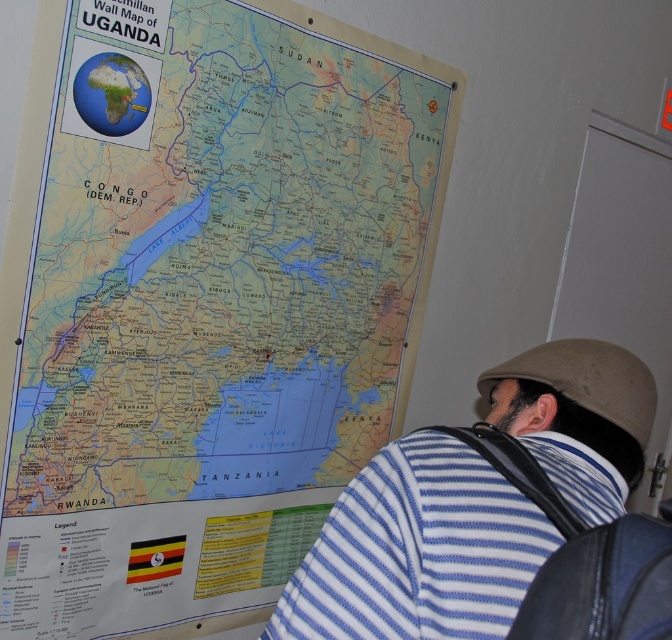
You are a visitor in a room and you see the matte paper map at upper center and the blue striped shirt at center. Which object is closer to you?

The matte paper map at upper center is closer to you because the blue striped shirt at center is behind it.

You are standing in front of the wall map of Uganda and notice two points marked on it. The first point is at coordinates point [44,592] and the second is at point [482,576]. Which point is closer to you?

Point [44,592] is further to the viewer than point [482,576], so the point closer to you is point [482,576].